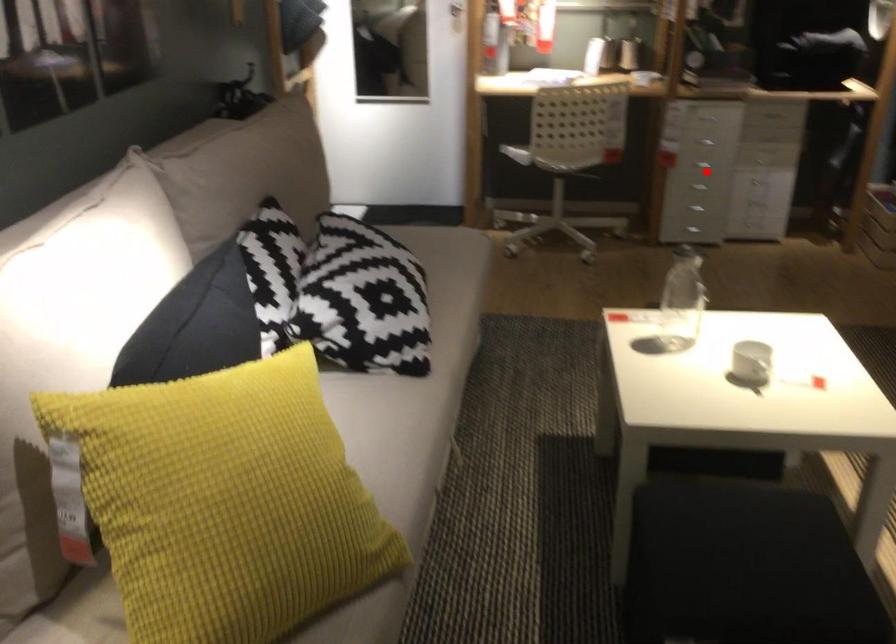
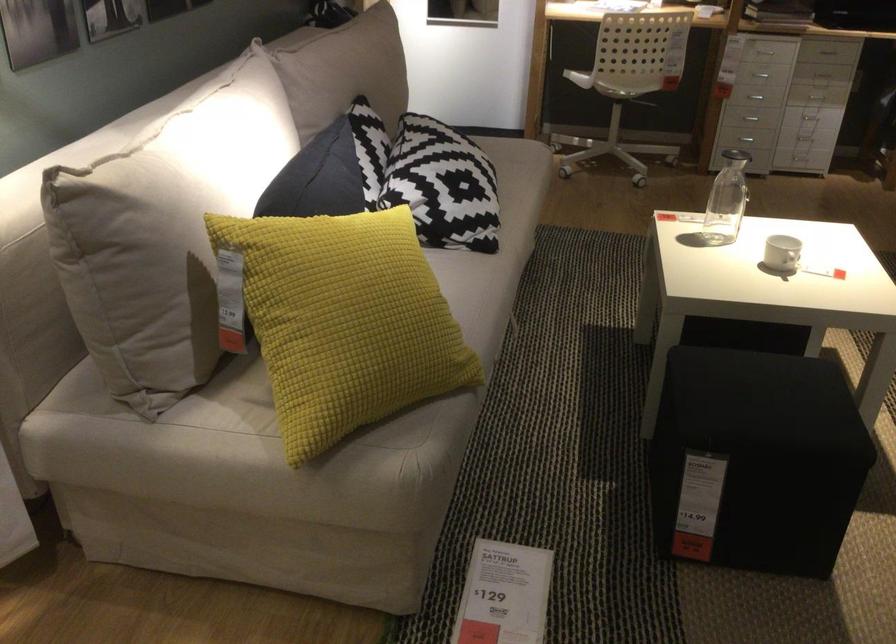
In the second image, find the point that corresponds to the highlighted location in the first image.

(755, 97)